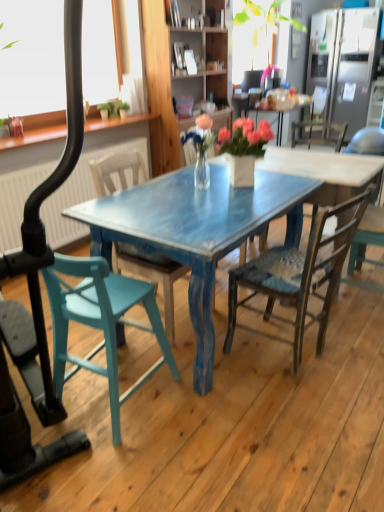
Question: Should I look upward or downward to see clear glass vase at center?

Choices:
 (A) up
 (B) down

Answer: (A)

Question: From a real-world perspective, does satin silver refrigerator at upper right stand above white matte window screen at upper left?

Choices:
 (A) yes
 (B) no

Answer: (B)

Question: Is satin silver refrigerator at upper right facing away from white matte window screen at upper left?

Choices:
 (A) yes
 (B) no

Answer: (B)

Question: Is satin silver refrigerator at upper right directly adjacent to white matte window screen at upper left?

Choices:
 (A) no
 (B) yes

Answer: (A)

Question: Are satin silver refrigerator at upper right and white matte window screen at upper left located far from each other?

Choices:
 (A) yes
 (B) no

Answer: (A)

Question: Can you confirm if satin silver refrigerator at upper right is thinner than white matte window screen at upper left?

Choices:
 (A) no
 (B) yes

Answer: (A)

Question: From the image's perspective, is satin silver refrigerator at upper right on top of white matte window screen at upper left?

Choices:
 (A) yes
 (B) no

Answer: (A)

Question: Is clear glass vase at center not inside wooden cabinet at center?

Choices:
 (A) no
 (B) yes

Answer: (B)

Question: Is wooden cabinet at center completely or partially inside clear glass vase at center?

Choices:
 (A) no
 (B) yes

Answer: (A)

Question: Is the depth of clear glass vase at center greater than that of wooden cabinet at center?

Choices:
 (A) no
 (B) yes

Answer: (A)

Question: Is clear glass vase at center at the right side of wooden cabinet at center?

Choices:
 (A) yes
 (B) no

Answer: (A)

Question: Is clear glass vase at center taller than wooden cabinet at center?

Choices:
 (A) yes
 (B) no

Answer: (B)

Question: Can you confirm if clear glass vase at center is shorter than wooden cabinet at center?

Choices:
 (A) no
 (B) yes

Answer: (B)

Question: Can you confirm if wooden cabinet at center is taller than white matte window screen at upper left?

Choices:
 (A) no
 (B) yes

Answer: (B)